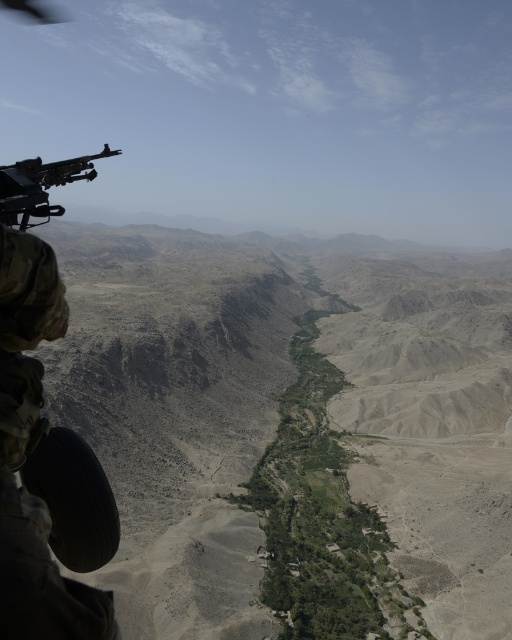
Between camouflage fabric helmet at left and polished metal machine gun at upper left, which one is positioned lower?

camouflage fabric helmet at left is lower down.

Looking at this image, who is taller, camouflage fabric helmet at left or polished metal machine gun at upper left?

With more height is polished metal machine gun at upper left.

This screenshot has height=640, width=512. I want to click on camouflage fabric helmet at left, so click(28, 452).